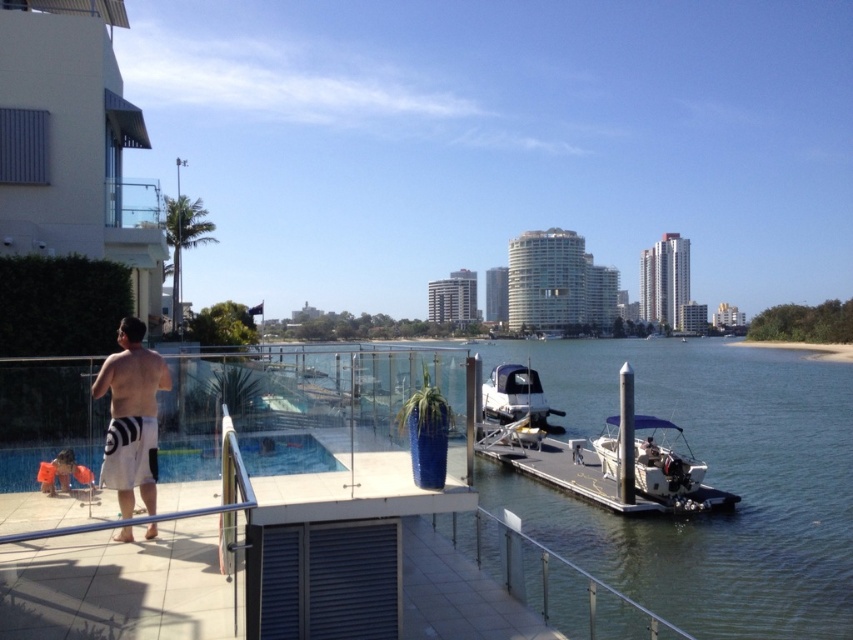
Question: Considering the relative positions of clear water at center and transparent glass pool at lower left in the image provided, where is clear water at center located with respect to transparent glass pool at lower left?

Choices:
 (A) right
 (B) left

Answer: (A)

Question: Which is nearer to the white cotton shorts at lower left?

Choices:
 (A) transparent glass pool at lower left
 (B) white matte boat at center
 (C) clear water at center

Answer: (A)

Question: Does white cotton shorts at lower left have a greater width compared to white matte boat at center?

Choices:
 (A) yes
 (B) no

Answer: (B)

Question: Which object appears farthest from the camera in this image?

Choices:
 (A) transparent glass pool at lower left
 (B) clear water at center

Answer: (B)

Question: Is clear water at center above white cotton shorts at lower left?

Choices:
 (A) yes
 (B) no

Answer: (B)

Question: Among these points, which one is farthest from the camera?

Choices:
 (A) (282, 445)
 (B) (498, 368)
 (C) (849, 618)
 (D) (148, 528)

Answer: (B)